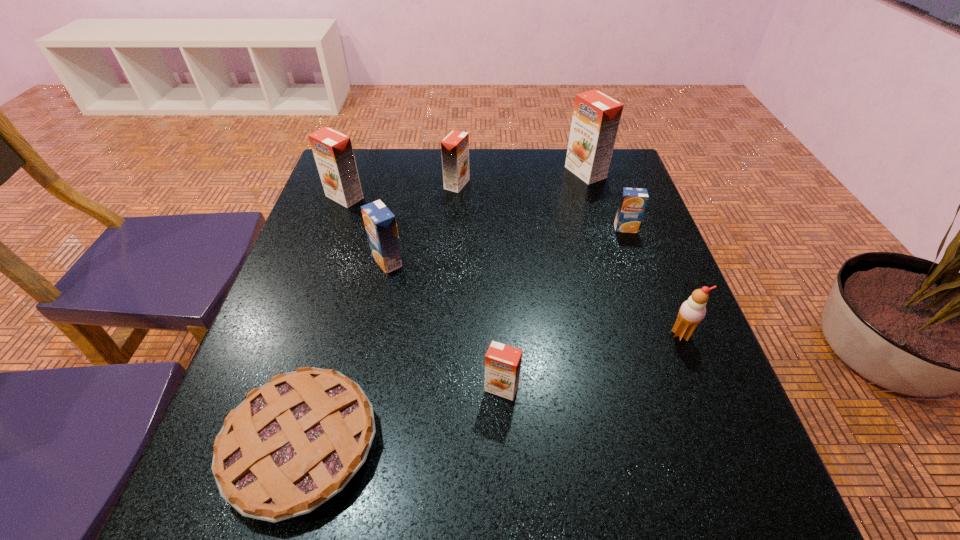
Where is `vacant point located between the pie and the fourth farthest object`? The image size is (960, 540). vacant point located between the pie and the fourth farthest object is located at coordinates (464, 336).

Where is `empty space that is in between the fourth object from left to right and the icecream`? This screenshot has height=540, width=960. empty space that is in between the fourth object from left to right and the icecream is located at coordinates (569, 259).

The image size is (960, 540). I want to click on vacant region between the tallest object and the third nearest object, so click(634, 253).

Find the location of `empty space that is in between the tallest object and the pie`. empty space that is in between the tallest object and the pie is located at coordinates (444, 308).

The width and height of the screenshot is (960, 540). Identify the location of vacant area that lies between the farther blue orange_juice and the icecream. (653, 281).

Locate which object is the closest to the second smallest orange orange juice. Please provide its 2D coordinates. Your answer should be formatted as a tuple, i.e. [(x, y)], where the tuple contains the x and y coordinates of a point satisfying the conditions above.

[(332, 150)]

This screenshot has height=540, width=960. In order to click on object that stands as the seventh closest to the nearest orange orange juice in this screenshot , I will do `click(596, 116)`.

Locate an element on the screen. The width and height of the screenshot is (960, 540). orange juice that stands as the closest to the shortest object is located at coordinates (502, 362).

Identify which orange juice is the second nearest to the third smallest orange orange juice. Please provide its 2D coordinates. Your answer should be formatted as a tuple, i.e. [(x, y)], where the tuple contains the x and y coordinates of a point satisfying the conditions above.

[(455, 146)]

In order to click on orange orange juice that is the second closest to the seventh shortest object in this screenshot , I will do `click(596, 116)`.